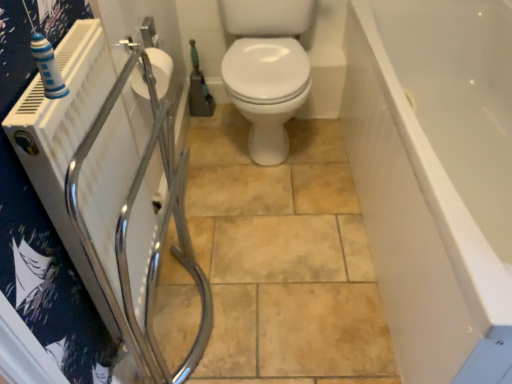
Question: From the image's perspective, is white glossy bathtub at right positioned above or below white matte toilet paper at upper left?

Choices:
 (A) above
 (B) below

Answer: (B)

Question: Choose the correct answer: Is white glossy bathtub at right inside white matte toilet paper at upper left or outside it?

Choices:
 (A) inside
 (B) outside

Answer: (B)

Question: Estimate the real-world distances between objects in this image. Which object is farther from the green rubber garden hose at center?

Choices:
 (A) white matte toilet paper at upper left
 (B) white glossy bathtub at right

Answer: (B)

Question: Estimate the real-world distances between objects in this image. Which object is closer to the white glossy bathtub at right?

Choices:
 (A) green rubber garden hose at center
 (B) white matte toilet paper at upper left

Answer: (B)